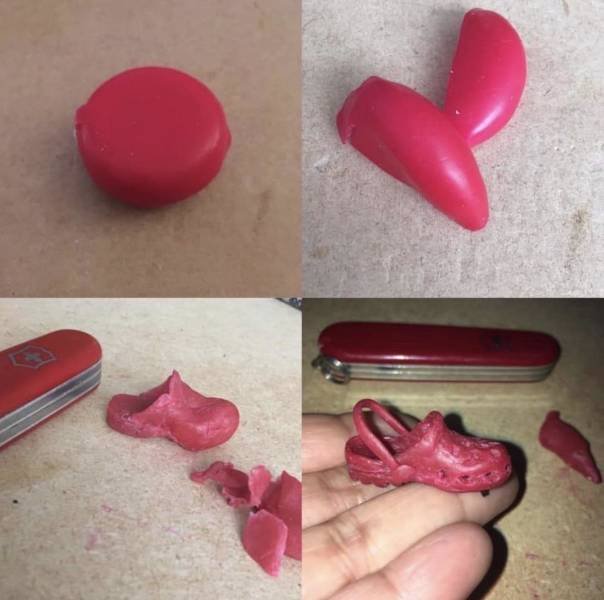
Find the location of a particular element. table is located at coordinates (109, 495), (562, 545), (568, 231), (74, 235).